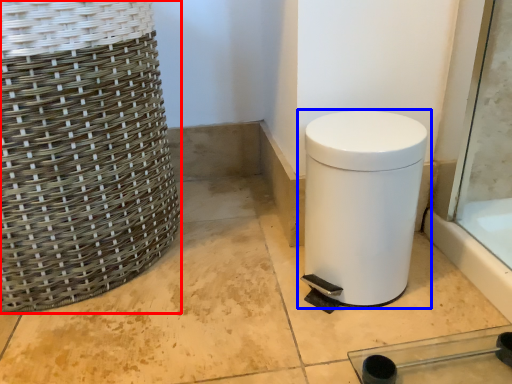
Question: Which object appears farthest to the camera in this image, basket (highlighted by a red box) or waste container (highlighted by a blue box)?

Choices:
 (A) basket
 (B) waste container

Answer: (B)